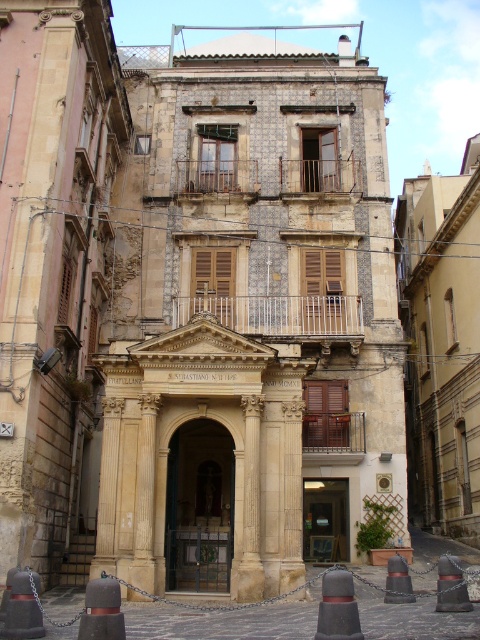
You are a construction worker who needs to place a decorative banner across the entrance of the historic building. The banner is designed to span the entire width of the smooth stone archway at center. Given that the smooth stone column at center is narrower than the archway, will the banner fit properly without needing adjustments?

The smooth stone archway at center is wider than the smooth stone column at center, so the banner designed to span the archway will fit properly without adjustments.

You are an architect examining the building and need to locate the smooth stone column at center. According to the coordinates provided, where should you look on the image?

The smooth stone column at center is located at coordinates point (251, 506).

You are a delivery driver who needs to park your van between the black rubber traffic cone at lower left and the brushed metal traffic cone at lower right. Can you fit your van, which is 2.5 meters wide, in the space between them?

The black rubber traffic cone at lower left is not as tall as the brushed metal traffic cone at lower right, but the distance between them isn